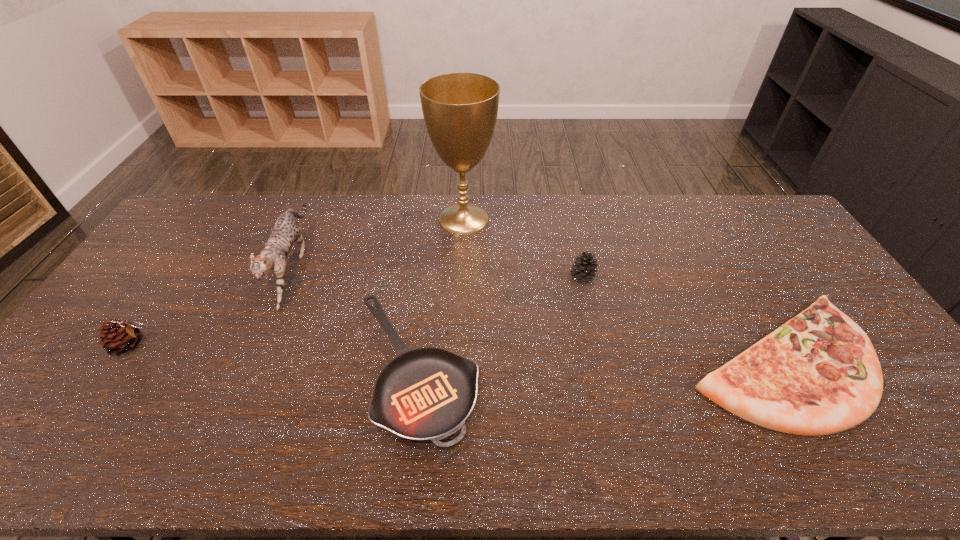
Locate an element on the screen. vacant space in between the farther pinecone and the leftmost object is located at coordinates (357, 312).

Where is `vacant space in between the trophy cup and the second object from right to left`? This screenshot has width=960, height=540. vacant space in between the trophy cup and the second object from right to left is located at coordinates (523, 248).

Where is `free space that is in between the trophy cup and the second shortest object`? The width and height of the screenshot is (960, 540). free space that is in between the trophy cup and the second shortest object is located at coordinates (622, 290).

This screenshot has width=960, height=540. What are the coordinates of `blank region between the leftmost object and the tallest object` in the screenshot? It's located at (298, 282).

Identify the location of free space between the shortest object and the tallest object. This screenshot has height=540, width=960. (440, 294).

The image size is (960, 540). I want to click on free space between the second shortest object and the left pinecone, so tap(456, 353).

This screenshot has width=960, height=540. Find the location of `free point between the second shortest object and the right pinecone`. free point between the second shortest object and the right pinecone is located at coordinates (682, 320).

Identify the location of free spot between the tallest object and the frying pan. click(x=440, y=294).

Choose which object is the second nearest neighbor to the nearer pinecone. Please provide its 2D coordinates. Your answer should be formatted as a tuple, i.e. [(x, y)], where the tuple contains the x and y coordinates of a point satisfying the conditions above.

[(425, 394)]

Select which object is the second closest to the frying pan. Please provide its 2D coordinates. Your answer should be formatted as a tuple, i.e. [(x, y)], where the tuple contains the x and y coordinates of a point satisfying the conditions above.

[(583, 271)]